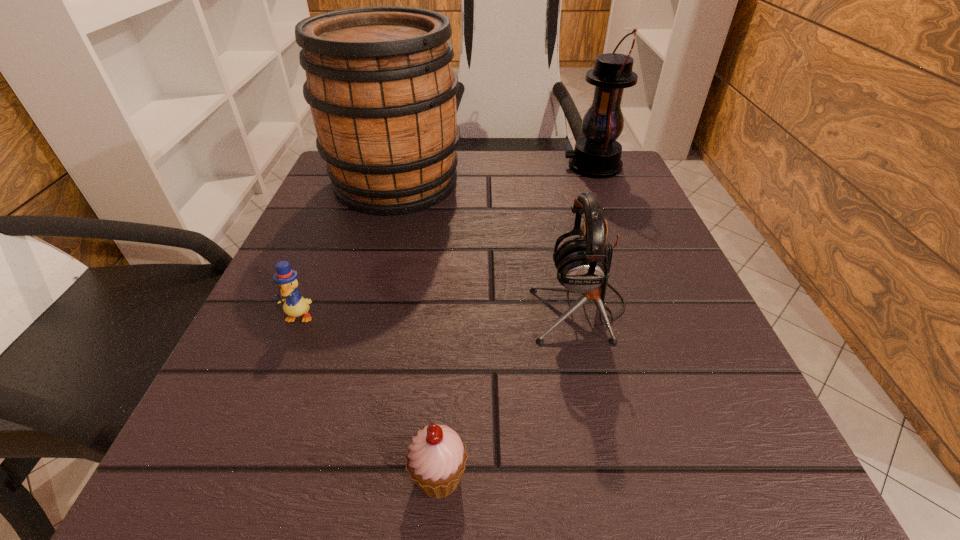
Identify the location of vacant space located 0.260m on the face of the duckling, where the monocle is placed. (219, 509).

I want to click on free spot located 0.350m on the back of the cupcake, so click(x=454, y=259).

The height and width of the screenshot is (540, 960). I want to click on cider located in the far edge section of the desktop, so click(379, 81).

The width and height of the screenshot is (960, 540). What are the coordinates of `lantern present at the far edge` in the screenshot? It's located at (597, 155).

Image resolution: width=960 pixels, height=540 pixels. What are the coordinates of `object that is positioned at the near edge` in the screenshot? It's located at (436, 458).

Locate an element on the screen. The image size is (960, 540). cider that is at the left edge is located at coordinates (379, 81).

You are a GUI agent. You are given a task and a screenshot of the screen. Output one action in this format:
    pyautogui.click(x=<x>, y=<y>)
    Task: Click on the duckling present at the left edge
    
    Given the screenshot: What is the action you would take?
    pyautogui.click(x=294, y=305)

Locate an element on the screen. This screenshot has height=540, width=960. lantern positioned at the right edge is located at coordinates (597, 155).

Locate an element on the screen. This screenshot has height=540, width=960. earphone present at the right edge is located at coordinates point(583,264).

Image resolution: width=960 pixels, height=540 pixels. Identify the location of object present at the far left corner. (379, 81).